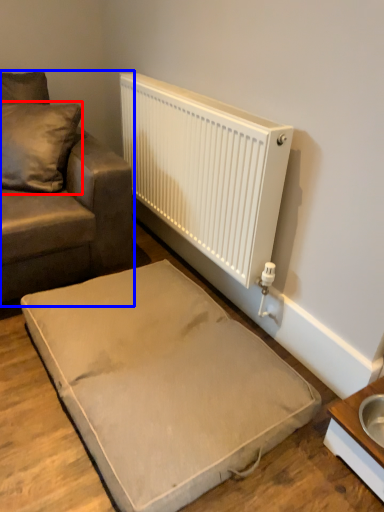
Question: Which object appears farthest to the camera in this image, pillow (highlighted by a red box) or studio couch (highlighted by a blue box)?

Choices:
 (A) pillow
 (B) studio couch

Answer: (A)